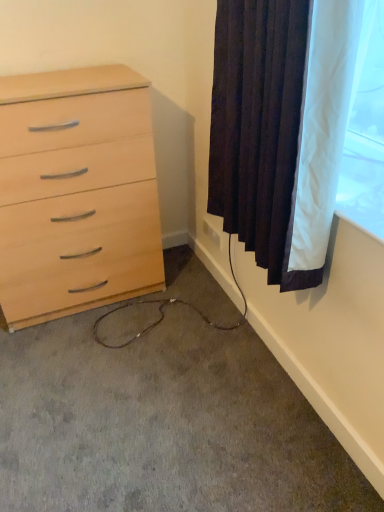
Question: In terms of width, does light wood chest of drawers at left look wider or thinner when compared to white plastic outlet at lower right?

Choices:
 (A) thin
 (B) wide

Answer: (B)

Question: Visually, is light wood chest of drawers at left positioned to the left or to the right of white plastic outlet at lower right?

Choices:
 (A) left
 (B) right

Answer: (A)

Question: Which object is the closest to the white plastic outlet at lower right?

Choices:
 (A) carpet at lower left
 (B) light wood chest of drawers at left
 (C) dark fabric curtain at upper right

Answer: (B)

Question: Which is farther from the white plastic outlet at lower right?

Choices:
 (A) carpet at lower left
 (B) dark fabric curtain at upper right
 (C) light wood chest of drawers at left

Answer: (A)